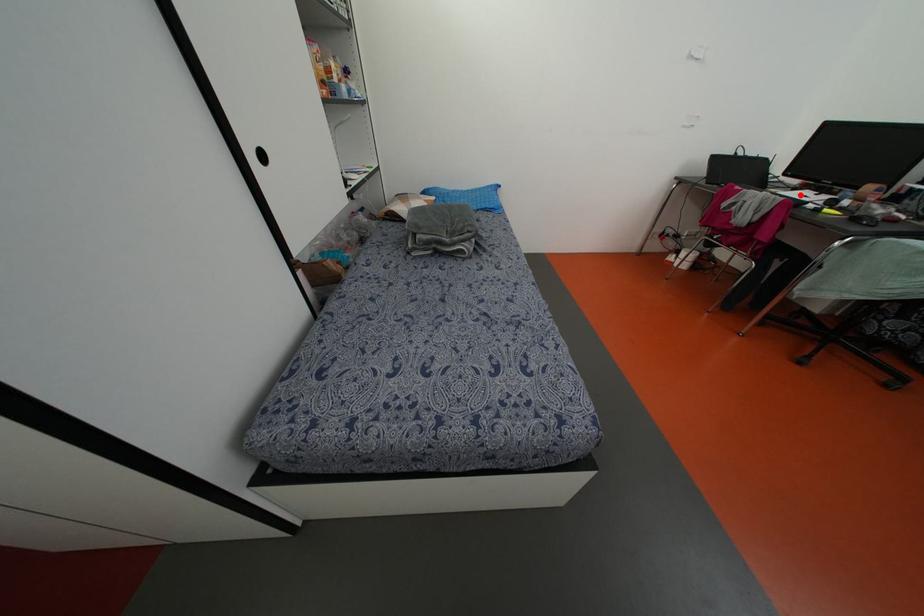
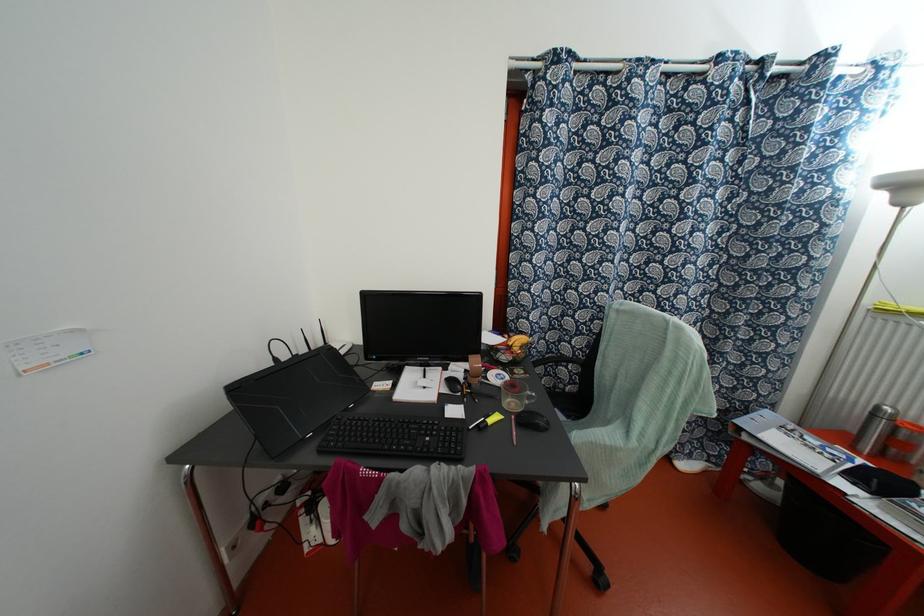
Find the pixel in the second image that matches the highlighted location in the first image.

(418, 386)